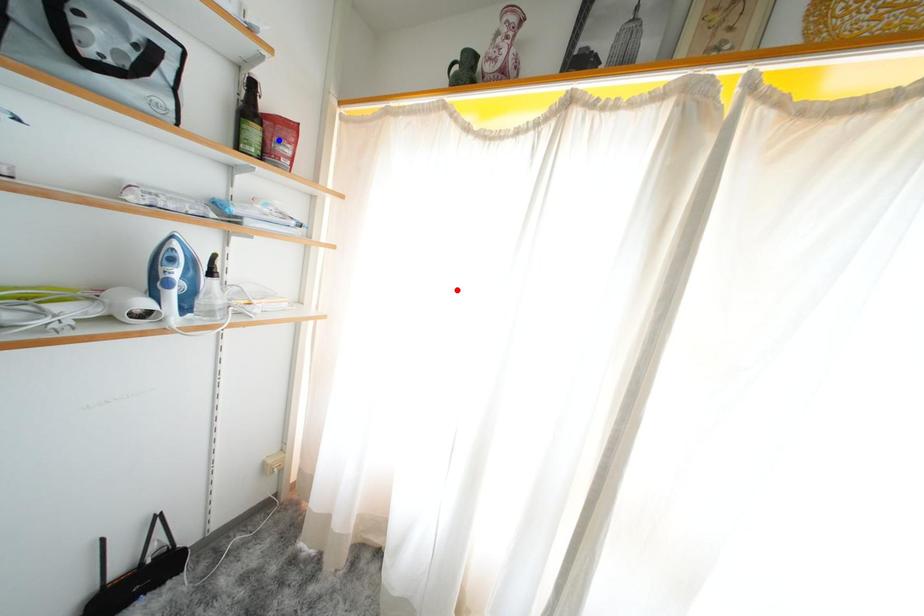
Question: In the image, two points are highlighted. Which point is nearer to the camera? Reply with the corresponding letter.

Choices:
 (A) blue point
 (B) red point

Answer: (B)